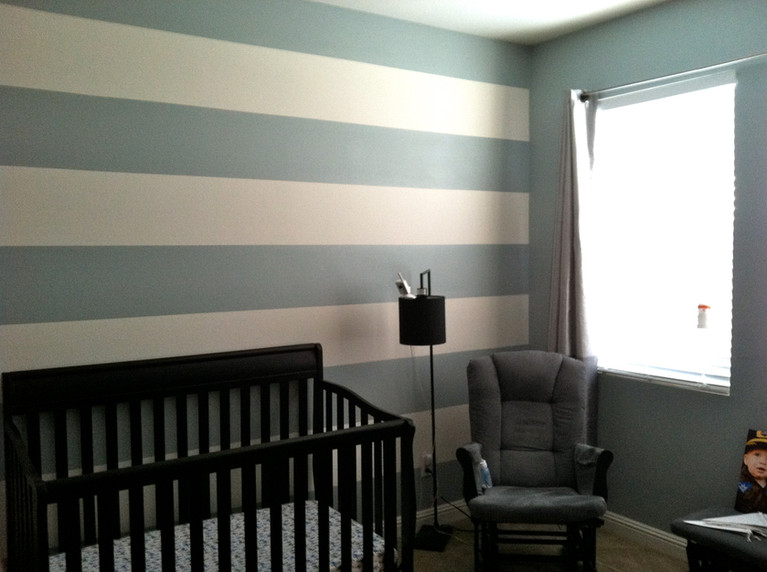
At what (x,y) coordinates should I click in order to perform the action: click on baby bottle. Please return your answer as a coordinate pair (x, y). This screenshot has height=572, width=767. Looking at the image, I should click on (485, 464).